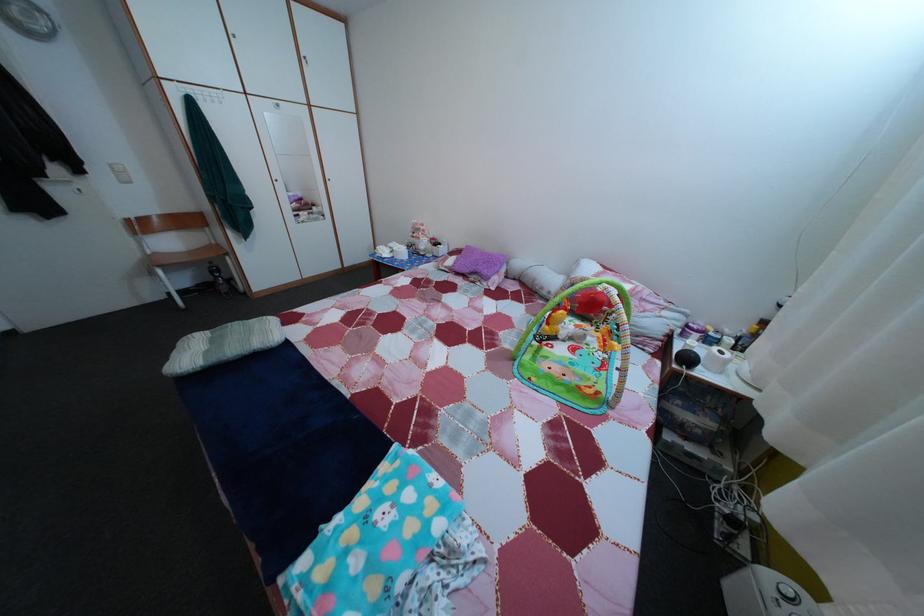
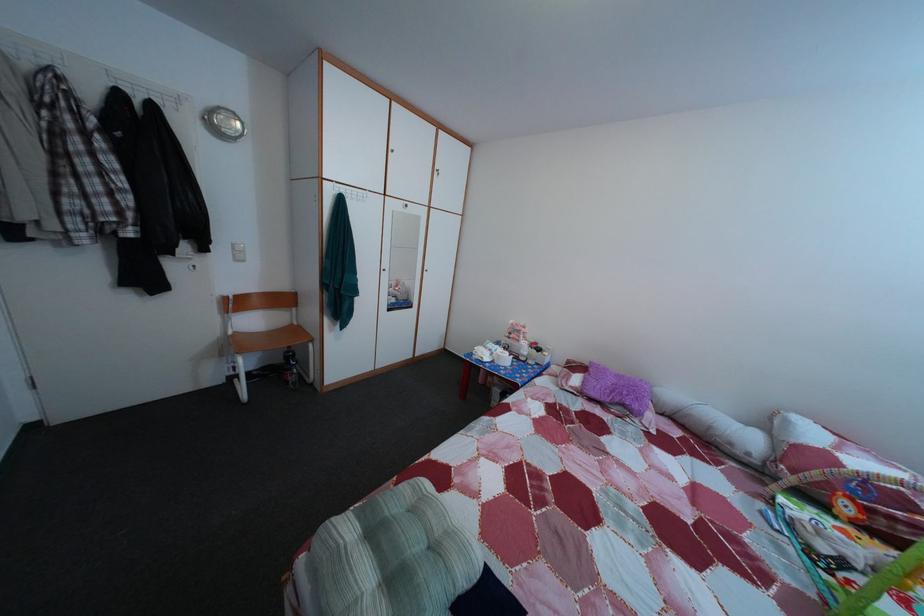
Locate, in the second image, the point that corresponds to point 429,246 in the first image.

(528, 349)